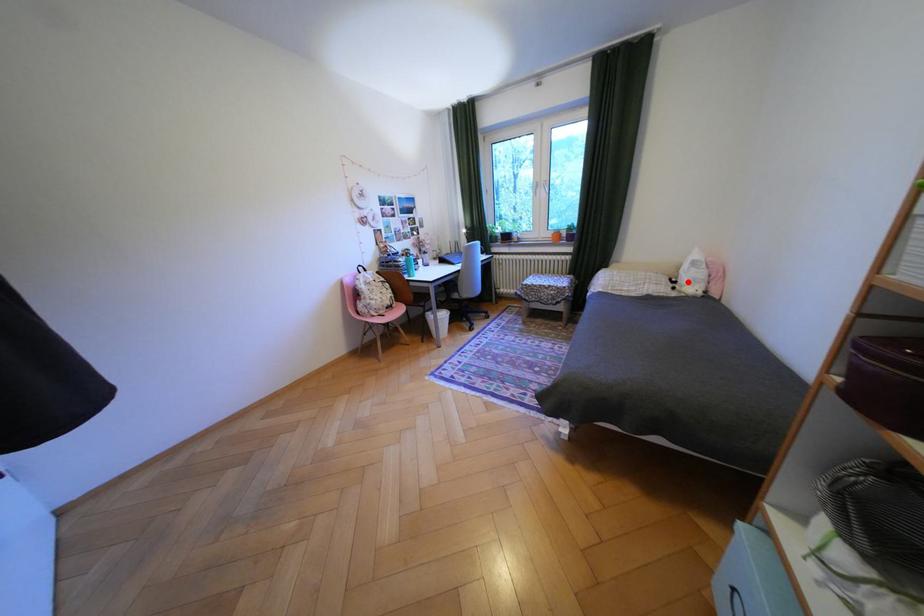
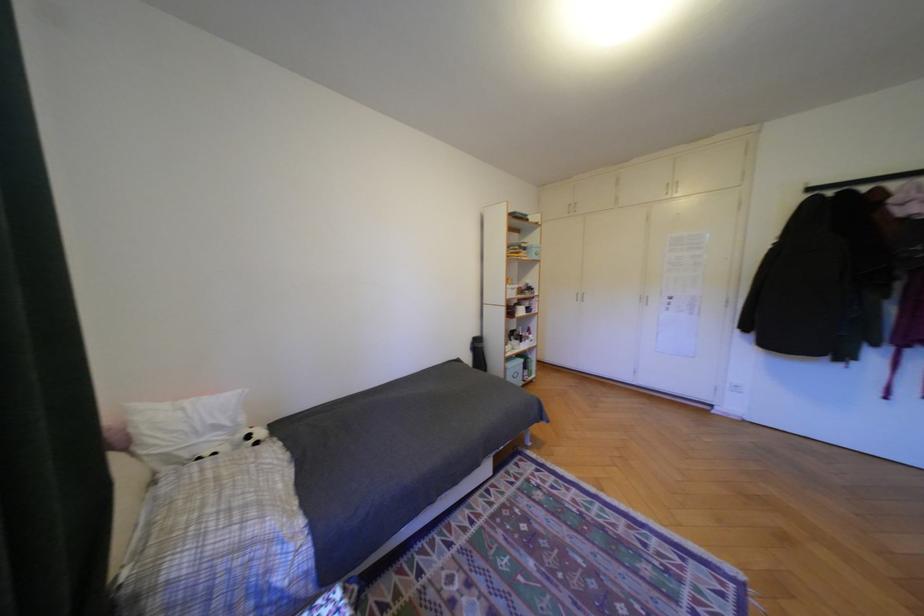
Where in the second image is the point corresponding to the highlighted location from the first image?

(261, 437)